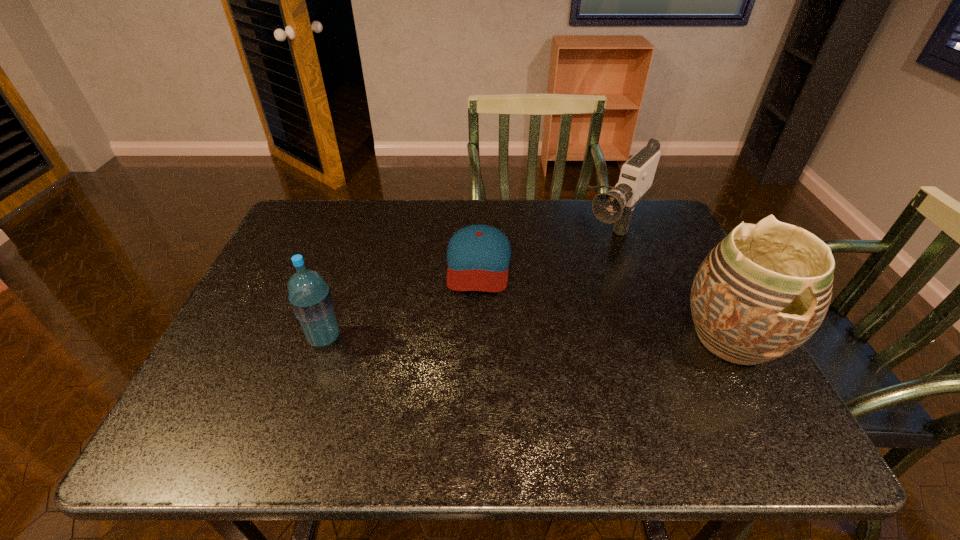
Find the location of a particular element. vacant space at the far edge is located at coordinates (356, 200).

In the image, there is a desktop. Where is `free space at the near edge`? free space at the near edge is located at coordinates (424, 388).

The image size is (960, 540). Find the location of `vacant space at the left edge of the desktop`. vacant space at the left edge of the desktop is located at coordinates (273, 282).

Find the location of a particular element. The height and width of the screenshot is (540, 960). free space at the far left corner is located at coordinates (328, 211).

Identify the location of vacant space at the near left corner. (241, 380).

Where is `vacant point at the far right corner`? The height and width of the screenshot is (540, 960). vacant point at the far right corner is located at coordinates (665, 210).

You are a GUI agent. You are given a task and a screenshot of the screen. Output one action in this format:
    pyautogui.click(x=<x>, y=<y>)
    Task: Click on the empty space that is in between the camcorder and the pottery
    This screenshot has width=960, height=540.
    Given the screenshot: What is the action you would take?
    pyautogui.click(x=672, y=283)

Where is `blank region between the pottery and the leftmost object`? The width and height of the screenshot is (960, 540). blank region between the pottery and the leftmost object is located at coordinates (528, 338).

Image resolution: width=960 pixels, height=540 pixels. Find the location of `vacant area that lies between the pottery and the leftmost object`. vacant area that lies between the pottery and the leftmost object is located at coordinates (528, 338).

I want to click on vacant point located between the camcorder and the shortest object, so click(546, 245).